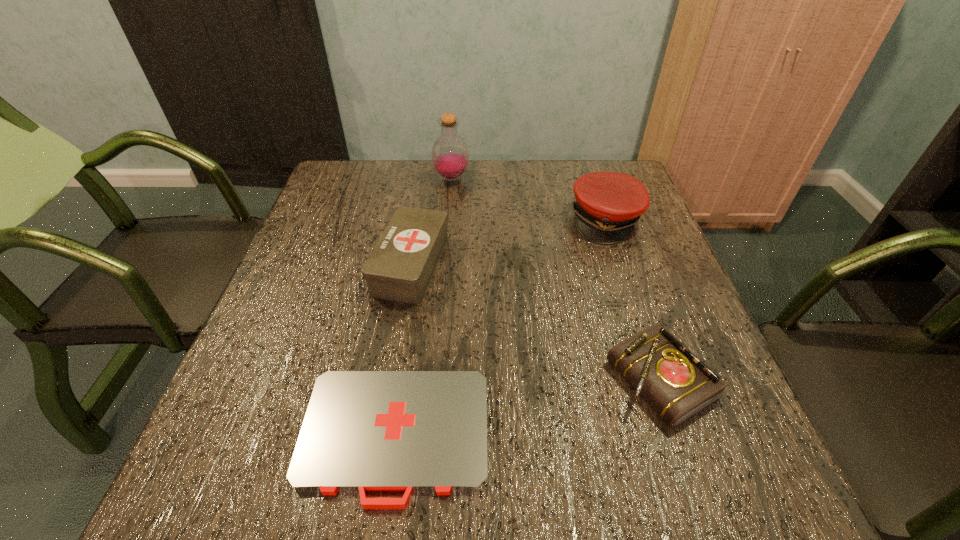
The width and height of the screenshot is (960, 540). In order to click on vacant region located on the left of the third tallest object in this screenshot , I will do `click(354, 265)`.

The width and height of the screenshot is (960, 540). In order to click on free space located 0.330m on the back of the diary in this screenshot , I will do `click(611, 234)`.

Where is `bottle that is at the far edge`? bottle that is at the far edge is located at coordinates (450, 156).

You are a GUI agent. You are given a task and a screenshot of the screen. Output one action in this format:
    pyautogui.click(x=<x>, y=<y>)
    Task: Click on the cap at the far edge
    The image size is (960, 540).
    Given the screenshot: What is the action you would take?
    pyautogui.click(x=608, y=204)

This screenshot has height=540, width=960. Find the location of `object that is at the near edge`. object that is at the near edge is located at coordinates (409, 431).

Locate an element on the screen. object that is at the left edge is located at coordinates (409, 431).

At what (x,y) coordinates should I click in order to perform the action: click on cap that is at the right edge. Please return your answer as a coordinate pair (x, y). This screenshot has width=960, height=540. Looking at the image, I should click on [608, 204].

The width and height of the screenshot is (960, 540). What are the coordinates of `diary that is at the right edge` in the screenshot? It's located at (675, 383).

At what (x,y) coordinates should I click in order to perform the action: click on object that is positioned at the near left corner. Please return your answer as a coordinate pair (x, y). The height and width of the screenshot is (540, 960). Looking at the image, I should click on (409, 431).

The width and height of the screenshot is (960, 540). What are the coordinates of `object present at the far right corner` in the screenshot? It's located at (608, 204).